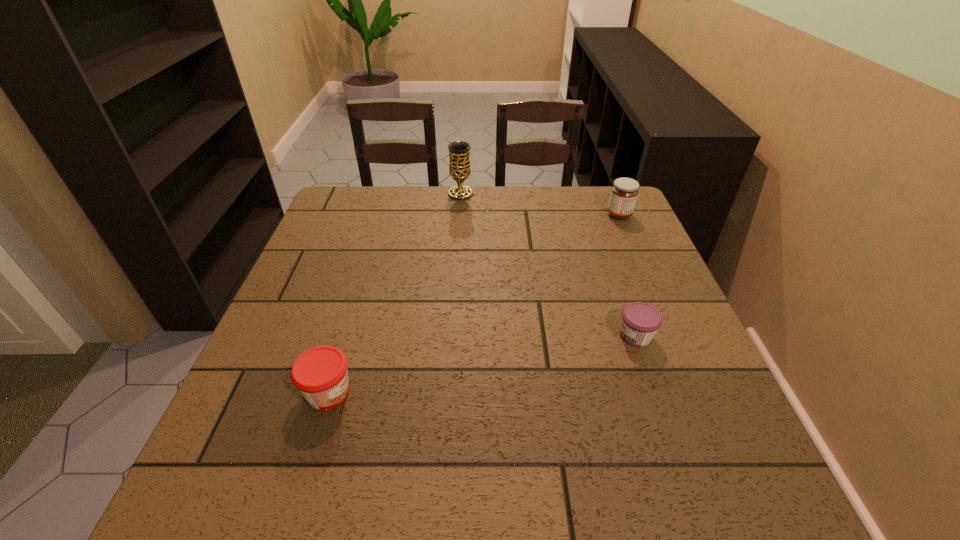
In order to click on vacant region located on the label side of the nearest jam in this screenshot , I will do `click(413, 392)`.

Find the location of a particular element. This screenshot has height=540, width=960. vacant area situated on the front label of the shortest jam is located at coordinates (481, 336).

This screenshot has width=960, height=540. I want to click on free location located 0.230m on the front label of the shortest jam, so click(509, 336).

In order to click on free space located 0.210m on the front label of the shortest jam in this screenshot , I will do `click(518, 336)`.

You are a GUI agent. You are given a task and a screenshot of the screen. Output one action in this format:
    pyautogui.click(x=<x>, y=<y>)
    Task: Click on the chalice present at the far edge
    Image resolution: width=960 pixels, height=540 pixels.
    Given the screenshot: What is the action you would take?
    pyautogui.click(x=459, y=151)

In order to click on jam present at the far edge in this screenshot , I will do `click(624, 192)`.

The width and height of the screenshot is (960, 540). What are the coordinates of `object situated at the left edge` in the screenshot? It's located at (321, 375).

The height and width of the screenshot is (540, 960). What are the coordinates of `object at the far right corner` in the screenshot? It's located at (624, 192).

Image resolution: width=960 pixels, height=540 pixels. Identify the location of vacant space at the far edge of the desktop. (420, 198).

Where is `blank area at the near edge`? This screenshot has width=960, height=540. blank area at the near edge is located at coordinates [573, 477].